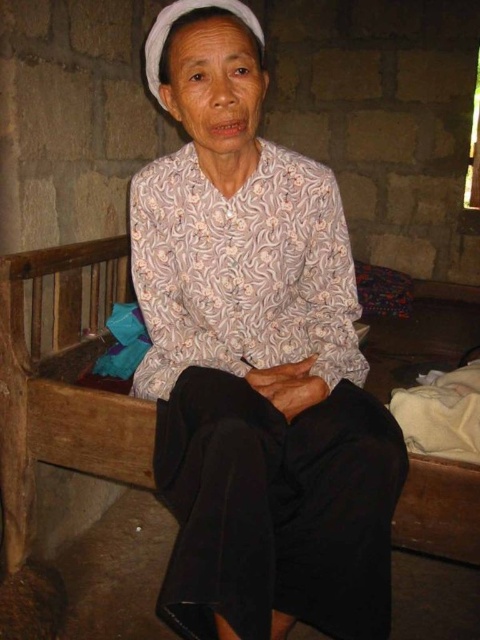
Question: Which object appears farthest from the camera in this image?

Choices:
 (A) white printed blouse at center
 (B) wooden bench at center

Answer: (B)

Question: Can you confirm if white printed blouse at center is smaller than wooden bench at center?

Choices:
 (A) no
 (B) yes

Answer: (B)

Question: Does white printed blouse at center come in front of wooden bench at center?

Choices:
 (A) no
 (B) yes

Answer: (B)

Question: Which point appears closest to the camera in this image?

Choices:
 (A) (178, 486)
 (B) (456, 305)

Answer: (A)

Question: Which of the following is the farthest from the observer?

Choices:
 (A) white printed blouse at center
 (B) wooden bench at center

Answer: (B)

Question: Does white printed blouse at center have a lesser width compared to wooden bench at center?

Choices:
 (A) yes
 (B) no

Answer: (B)